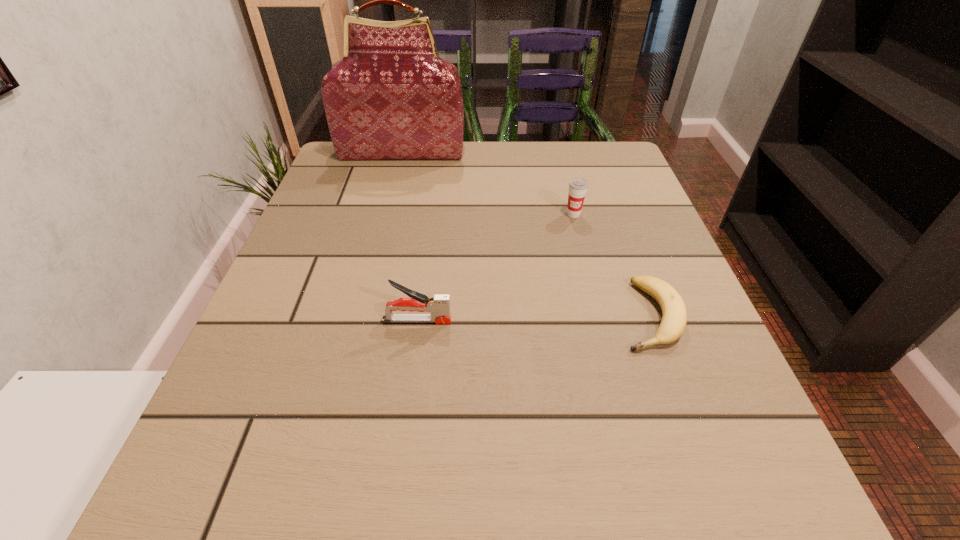
Image resolution: width=960 pixels, height=540 pixels. In order to click on free space between the stapler and the handbag in this screenshot , I will do `click(410, 236)`.

Find the location of a particular element. object that is the closest to the shortest object is located at coordinates (578, 187).

Image resolution: width=960 pixels, height=540 pixels. I want to click on the third closest object to the banana, so click(391, 96).

The image size is (960, 540). I want to click on vacant space that satisfies the following two spatial constraints: 1. on the side of the second farthest object with the logo; 2. on the handle side of the stapler, so click(x=601, y=320).

I want to click on vacant space that satisfies the following two spatial constraints: 1. on the side of the third object from left to right with the logo; 2. on the handle side of the stapler, so click(x=601, y=320).